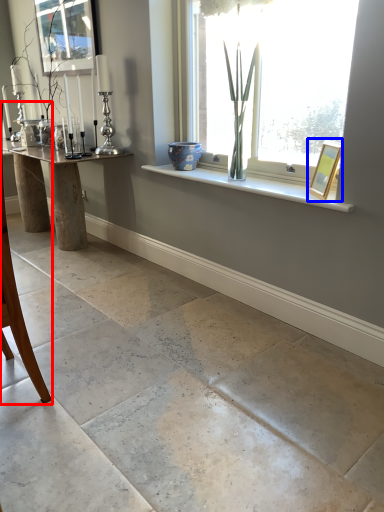
Question: Which object appears closest to the camera in this image, armchair (highlighted by a red box) or picture frame (highlighted by a blue box)?

Choices:
 (A) armchair
 (B) picture frame

Answer: (A)